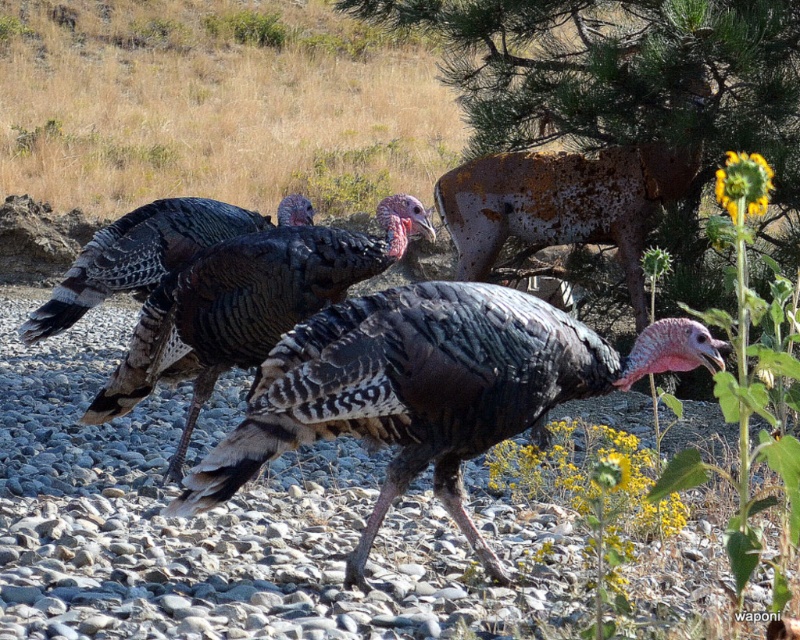
You are a photographer trying to capture the shiny black turkey at center. You have a camera with a zoom lens. The camera has a focus point at point (429, 388). Where should you aim the camera to focus on the shiny black turkey at center?

The point (429, 388) corresponds to the shiny black turkey at center, so you should aim the camera at that point to focus on it.

You are a photographer trying to capture the shiny black turkey at center and the shiny black feathers at center in a single shot. Which object should you focus on to ensure the turkey is in sharp focus while the feathers are slightly blurred?

You should focus on the shiny black turkey at center because it is closer to the viewer than the shiny black feathers at center, so focusing on the turkey will keep it sharp while the feathers in the background appear blurred.